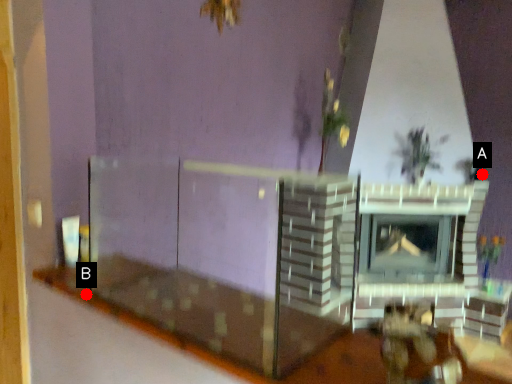
Question: Two points are circled on the image, labeled by A and B beside each circle. Which point is closer to the camera?

Choices:
 (A) A is closer
 (B) B is closer

Answer: (B)